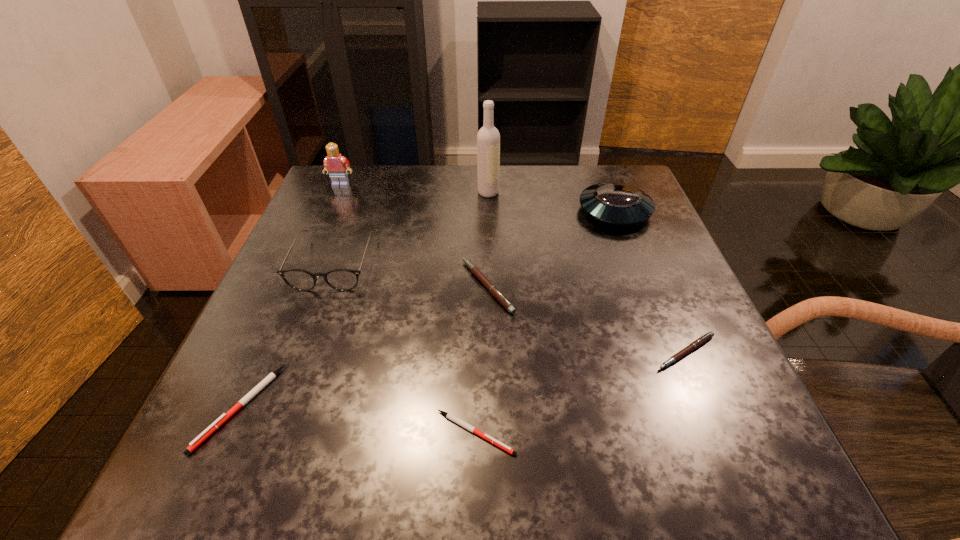
Image resolution: width=960 pixels, height=540 pixels. In order to click on the tallest object in this screenshot , I will do `click(488, 138)`.

You are a GUI agent. You are given a task and a screenshot of the screen. Output one action in this format:
    pyautogui.click(x=<x>, y=<y>)
    Task: Click on the vodka
    The width and height of the screenshot is (960, 540).
    Given the screenshot: What is the action you would take?
    pyautogui.click(x=488, y=138)

Locate an element on the screen. the seventh shortest object is located at coordinates (335, 164).

Identify the location of saucer. (617, 203).

Image resolution: width=960 pixels, height=540 pixels. I want to click on black spectacles, so click(339, 279).

This screenshot has height=540, width=960. I want to click on the farther pink pen, so click(x=493, y=290).

Locate an element on the screen. the bigger pink pen is located at coordinates tap(493, 290).

I want to click on the smaller pink pen, so click(709, 335).

Find the location of a particular element. Image resolution: width=960 pixels, height=540 pixels. the nearer pink pen is located at coordinates (709, 335).

At what (x,y) coordinates should I click in order to perform the action: click on the bigger white pen. Please return your answer as a coordinate pair (x, y). Looking at the image, I should click on (224, 417).